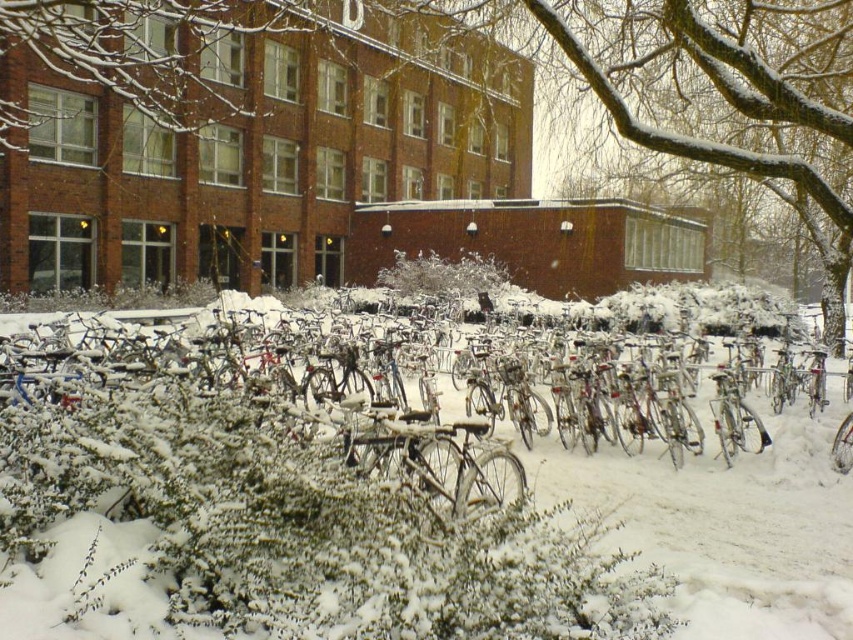
Question: Is metallic silver bicycle at center wider than white fluffy bush at center?

Choices:
 (A) yes
 (B) no

Answer: (A)

Question: Which point is farther to the camera?

Choices:
 (A) white fluffy bush at center
 (B) metallic silver bicycle at center

Answer: (A)

Question: Is metallic silver bicycle at center to the left of white fluffy bush at center from the viewer's perspective?

Choices:
 (A) yes
 (B) no

Answer: (A)

Question: Which point appears farthest from the camera in this image?

Choices:
 (A) (413, 280)
 (B) (682, 509)

Answer: (A)

Question: Can you confirm if metallic silver bicycle at center is wider than white fluffy bush at center?

Choices:
 (A) yes
 (B) no

Answer: (A)